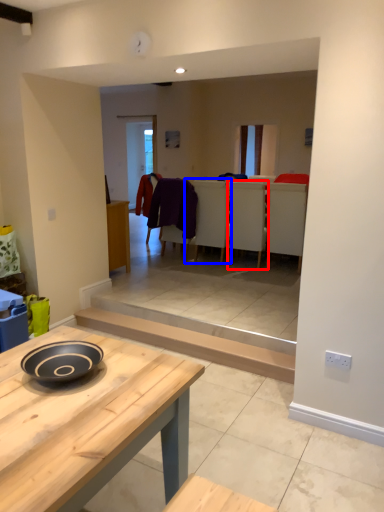
Question: Among these objects, which one is farthest to the camera, chair (highlighted by a red box) or armchair (highlighted by a blue box)?

Choices:
 (A) chair
 (B) armchair

Answer: (B)